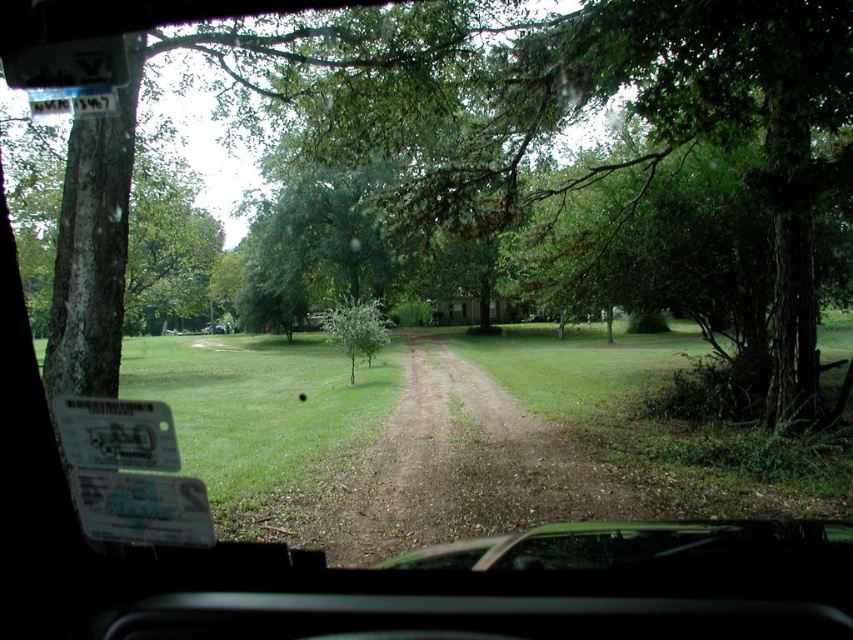
You are driving a car and want to know if you can see the green leafy tree at center from your current position. Since the brown gravel dirt track at center is in front of you, does the tree block your view?

The brown gravel dirt track at center has a lesser height compared to green leafy tree at center, so the tree is taller and may block your view of it from your current position.

You are driving a car with a trunk that is 1.5 meters long. You want to park your car on the brown gravel dirt track at center so that the trunk is fully on the track. Can you do this?

The brown gravel dirt track at center is 5.55 meters away from viewer. Since the trunk is only 1.5 meters long, you can park the car so that the trunk is fully on the track.

You are sitting in the driver seat of the car and looking out through the windshield. There are two points marked on the windshield at coordinates point (x=450, y=456) and point (x=357, y=348). Which point is closer to you?

Point (x=450, y=456) is closer to the viewer than point (x=357, y=348).